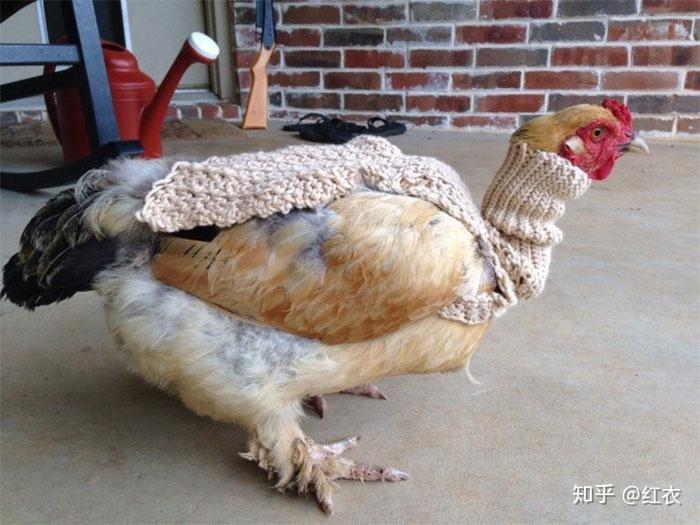
Where is `wall`? The width and height of the screenshot is (700, 525). wall is located at coordinates (498, 23).